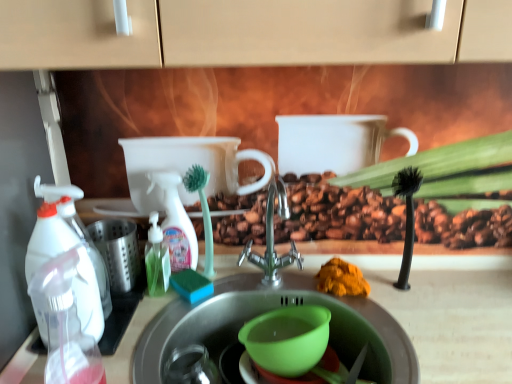
Question: Is point (158, 264) closer or farther from the camera than point (338, 258)?

Choices:
 (A) farther
 (B) closer

Answer: (B)

Question: Considering the positions of translucent plastic bottle at center-left, which appears as the 2th bottle when viewed from the left, and orange powder at sink in the image, is translucent plastic bottle at center-left, which appears as the 2th bottle when viewed from the left, bigger or smaller than orange powder at sink?

Choices:
 (A) small
 (B) big

Answer: (A)

Question: Which object is positioned closest to the transparent plastic spray bottle at left, acting as the first cleaning product starting from the left?

Choices:
 (A) white plastic spray bottle at center, acting as the first cleaning product starting from the back
 (B) transparent plastic spray bottle at left, the second bottle viewed from the right
 (C) orange powder at sink
 (D) satin nickel faucet at center
 (E) translucent plastic bottle at center-left, the 1th bottle when ordered from back to front

Answer: (B)

Question: Which object is the farthest from the translucent plastic bottle at center-left, positioned as the 2th bottle in front-to-back order?

Choices:
 (A) transparent plastic spray bottle at left, the second bottle viewed from the right
 (B) stainless steel sink at center
 (C) white plastic spray bottle at center, the 1th cleaning product in the right-to-left sequence
 (D) satin nickel faucet at center
 (E) green plastic mixing bowl at sink

Answer: (A)